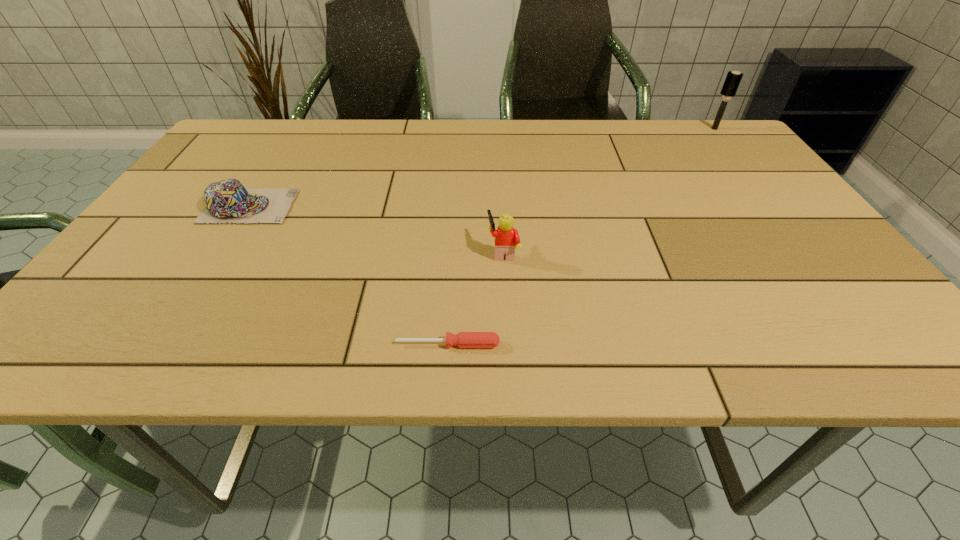
Image resolution: width=960 pixels, height=540 pixels. In order to click on the farthest object in this screenshot , I will do `click(733, 79)`.

The image size is (960, 540). I want to click on the rightmost object, so click(733, 79).

Identify the location of the third farthest object. (507, 239).

Find the location of a particular element. the second tallest object is located at coordinates (507, 239).

Image resolution: width=960 pixels, height=540 pixels. What are the coordinates of `cap` in the screenshot? It's located at (227, 200).

This screenshot has height=540, width=960. I want to click on the leftmost object, so click(227, 200).

The image size is (960, 540). Find the location of `the nearest object`. the nearest object is located at coordinates (463, 339).

I want to click on screwdriver, so click(x=463, y=339).

At what (x,y) coordinates should I click in order to perform the action: click on vacant space situated 0.360m on the left of the tallest object. Please return your answer as a coordinate pair (x, y). This screenshot has width=960, height=540. Looking at the image, I should click on (586, 129).

Find the location of a particular element. Image resolution: width=960 pixels, height=540 pixels. blank space located in front of the third farthest object with the accessory visible is located at coordinates pyautogui.click(x=424, y=252).